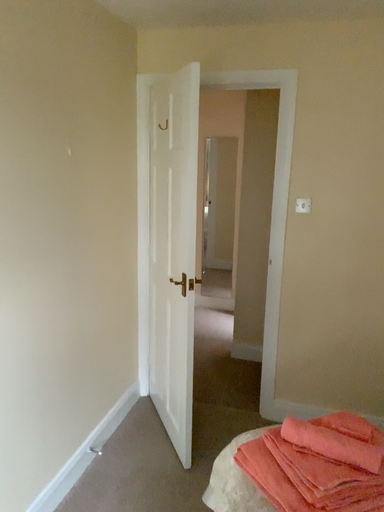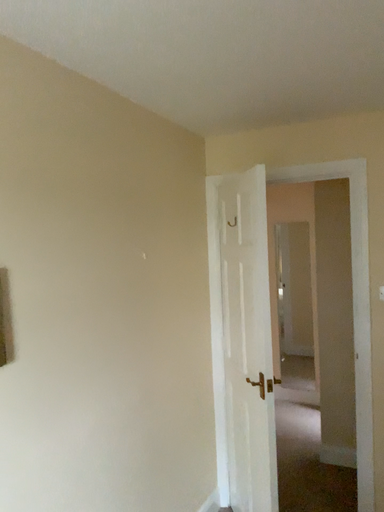
Question: How did the camera likely rotate when shooting the video?

Choices:
 (A) rotated upward
 (B) rotated downward

Answer: (A)